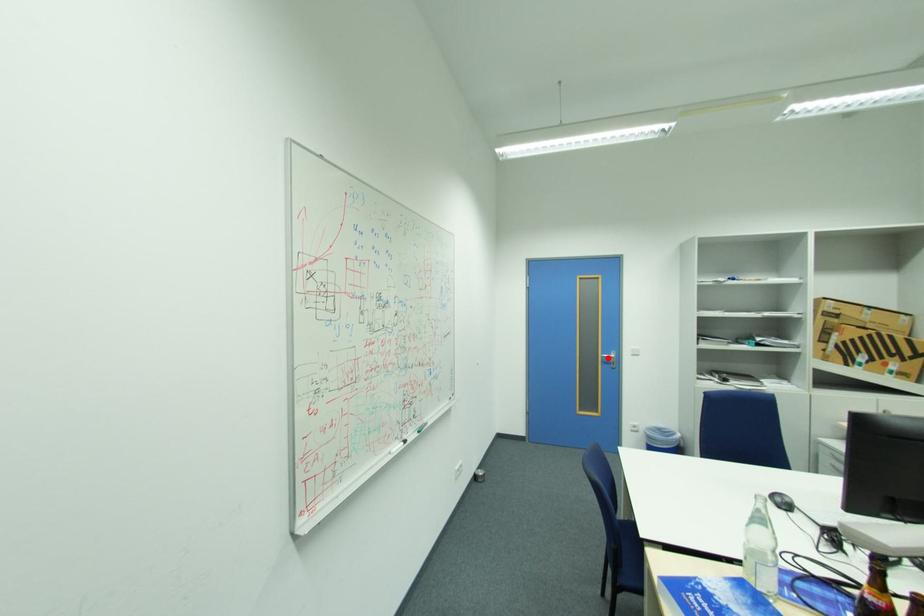
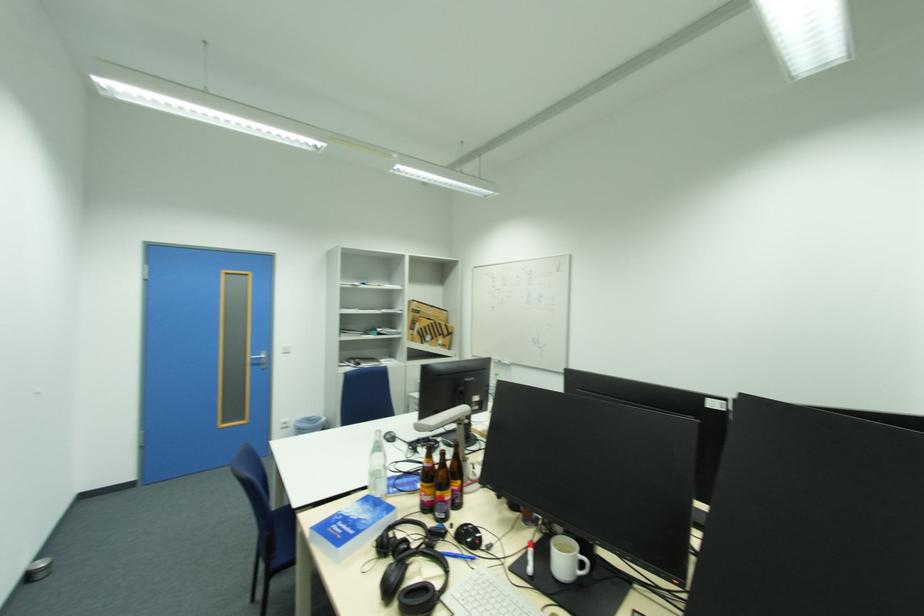
Locate, in the second image, the point that corresponds to the highlighted location in the first image.

(258, 360)